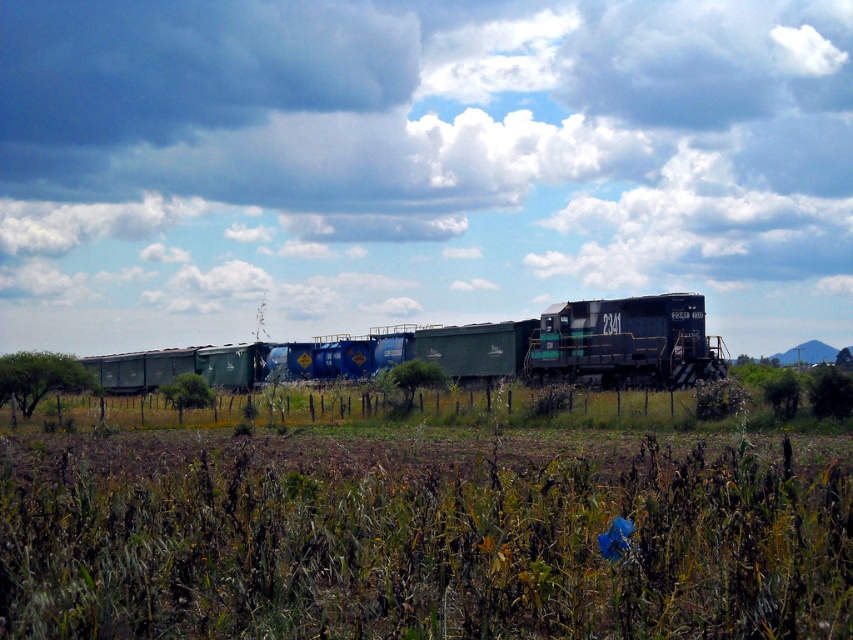
You are standing in the field and looking at the cloudy sky at upper center and the green matte freight car at center. Which one appears wider from your perspective?

The cloudy sky at upper center appears wider than the green matte freight car at center because its width is larger according to the description.

You are standing in the field and want to look up at the cloudy sky at upper center. What direction should you look?

You should look upward because the cloudy sky at upper center is located above you at point (422,145).

You are standing at the point closest to the train in the image. Which of the two points, point [12,61] or point [293,369], is farther away from you?

Point [12,61] is behind point [293,369], so it is farther away from you.